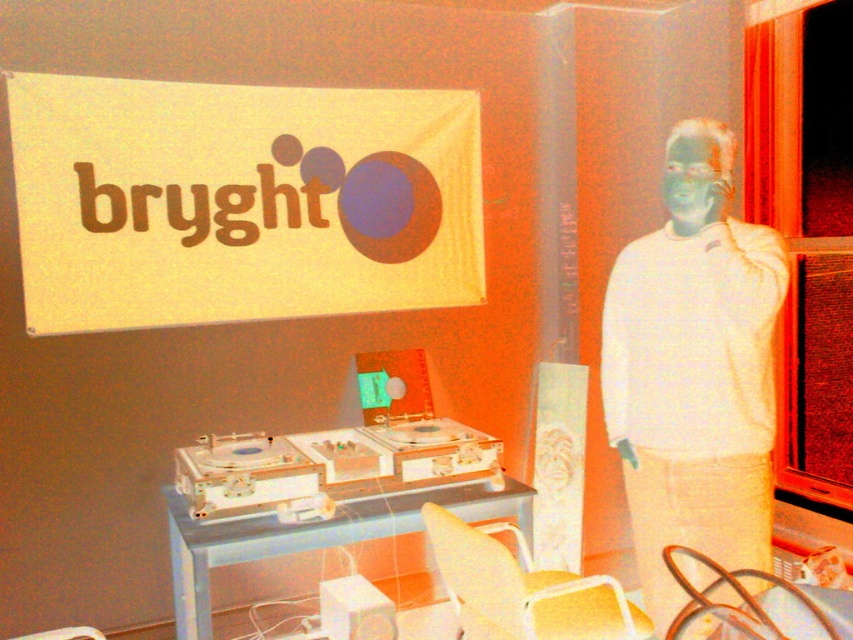
Can you confirm if white fabric banner at upper left is positioned above white matte sweater at right?

Yes, white fabric banner at upper left is above white matte sweater at right.

Between white fabric banner at upper left and white matte sweater at right, which one is positioned lower?

white matte sweater at right is below.

The height and width of the screenshot is (640, 853). I want to click on white fabric banner at upper left, so click(x=241, y=202).